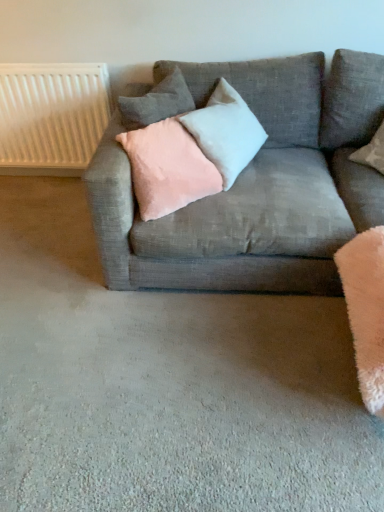
Question: Can you confirm if pink velvet pillow at center, marked as the first pillow in a bottom-to-top arrangement, is wider than textured gray couch at center?

Choices:
 (A) yes
 (B) no

Answer: (B)

Question: Does pink velvet pillow at center, marked as the first pillow in a bottom-to-top arrangement, have a lesser width compared to textured gray couch at center?

Choices:
 (A) no
 (B) yes

Answer: (B)

Question: Does pink velvet pillow at center, which is the third pillow in top-to-bottom order, appear on the right side of textured gray couch at center?

Choices:
 (A) yes
 (B) no

Answer: (B)

Question: Is the surface of pink velvet pillow at center, which is the third pillow in top-to-bottom order, in direct contact with textured gray couch at center?

Choices:
 (A) no
 (B) yes

Answer: (A)

Question: Considering the relative sizes of pink velvet pillow at center, marked as the first pillow in a bottom-to-top arrangement, and textured gray couch at center in the image provided, is pink velvet pillow at center, marked as the first pillow in a bottom-to-top arrangement, smaller than textured gray couch at center?

Choices:
 (A) yes
 (B) no

Answer: (A)

Question: In terms of size, does textured gray couch at center appear bigger or smaller than pink velvet pillow at upper center, which is the 3th pillow in bottom-to-top order?

Choices:
 (A) small
 (B) big

Answer: (B)

Question: From their relative heights in the image, would you say textured gray couch at center is taller or shorter than pink velvet pillow at upper center, which appears as the first pillow when viewed from the top?

Choices:
 (A) tall
 (B) short

Answer: (A)

Question: Is textured gray couch at center wider or thinner than pink velvet pillow at upper center, which is the 3th pillow in bottom-to-top order?

Choices:
 (A) wide
 (B) thin

Answer: (A)

Question: Is textured gray couch at center inside or outside of pink velvet pillow at upper center, which appears as the first pillow when viewed from the top?

Choices:
 (A) inside
 (B) outside

Answer: (B)

Question: Is point (243, 271) closer or farther from the camera than point (221, 155)?

Choices:
 (A) farther
 (B) closer

Answer: (B)

Question: From a real-world perspective, relative to satin light gray pillow at center, acting as the second pillow starting from the top, is textured gray couch at center vertically above or below?

Choices:
 (A) above
 (B) below

Answer: (B)

Question: In terms of width, does textured gray couch at center look wider or thinner when compared to satin light gray pillow at center, acting as the second pillow starting from the top?

Choices:
 (A) wide
 (B) thin

Answer: (A)

Question: From the image's perspective, is textured gray couch at center above or below satin light gray pillow at center, acting as the second pillow starting from the top?

Choices:
 (A) above
 (B) below

Answer: (B)

Question: Considering their positions, is satin light gray pillow at center, which is the second pillow from bottom to top, located in front of or behind textured gray couch at center?

Choices:
 (A) front
 (B) behind

Answer: (B)

Question: Is satin light gray pillow at center, acting as the second pillow starting from the top, bigger or smaller than textured gray couch at center?

Choices:
 (A) big
 (B) small

Answer: (B)